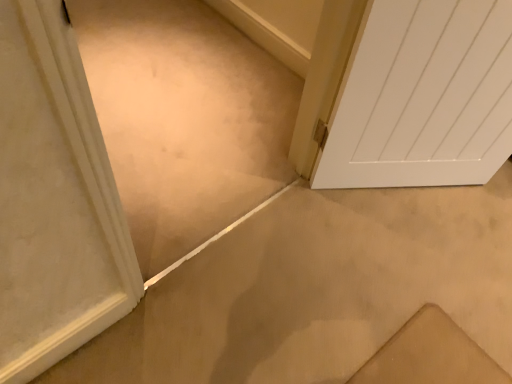
This screenshot has height=384, width=512. Describe the element at coordinates (316, 289) in the screenshot. I see `beige carpet at center` at that location.

Where is `beige carpet at center`? beige carpet at center is located at coordinates (316, 289).

Locate an element on the screen. This screenshot has height=384, width=512. beige carpet at center is located at coordinates (316, 289).